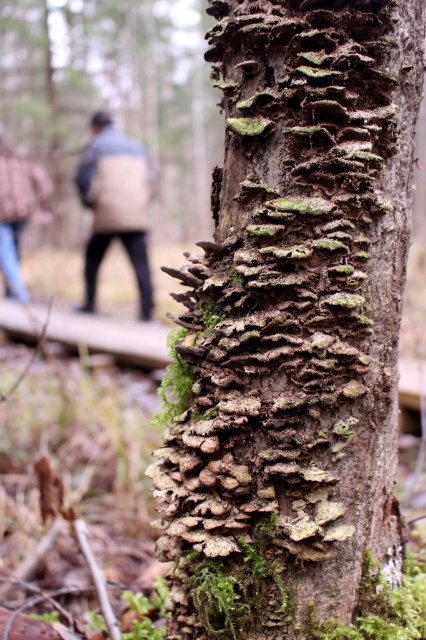
In the scene shown: You are a photographer standing in a forest. You want to take a photo of the green mossy bark at center and the beige wool coat at left. If your camera has a depth of field that can focus on objects within 5 meters, will both subjects be in focus?

The green mossy bark at center is 5.18 meters away from the beige wool coat at left. Since the distance between them is greater than 5 meters, the camera cannot keep both in focus simultaneously with the given depth of field.

You are an outdoor photographer who wants to capture a detailed shot of the green mossy bark at center and the beige wool coat at left. Considering their sizes, which object should you focus on to ensure both are in frame without needing to zoom in or out?

The beige wool coat at left occupies more space than the green mossy bark at center, so focusing on the beige wool coat at left first would allow the green mossy bark at center to fit within the frame without needing to adjust the zoom.

You are a botanist examining the tree trunk. You notice a spot at point (293, 321). What is growing there?

The green mossy bark at center is located at point (293, 321).